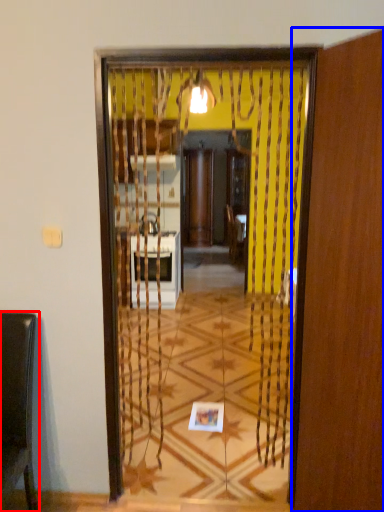
Question: Which object appears closest to the camera in this image, furniture (highlighted by a red box) or screen door (highlighted by a blue box)?

Choices:
 (A) furniture
 (B) screen door

Answer: (B)